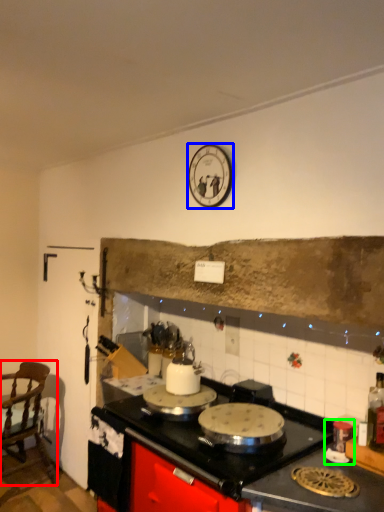
Question: Which is farther away from chair (highlighted by a red box)? clock (highlighted by a blue box) or appliance (highlighted by a green box)?

Choices:
 (A) clock
 (B) appliance

Answer: (B)